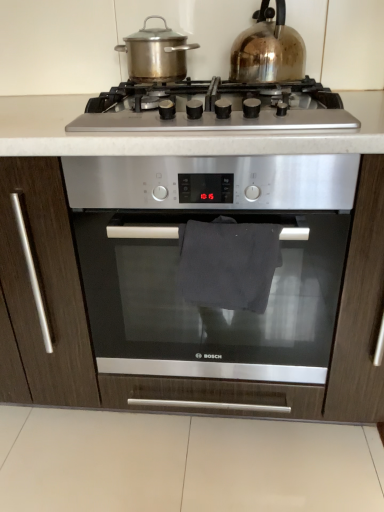
Question: Is dark fabric towel at center directly adjacent to stainless steel pot at upper center, placed as the first kitchen appliance when sorted from left to right?

Choices:
 (A) no
 (B) yes

Answer: (A)

Question: Can stainless steel pot at upper center, which is counted as the second kitchen appliance, starting from the right, be found inside dark fabric towel at center?

Choices:
 (A) yes
 (B) no

Answer: (B)

Question: Considering the relative positions of dark fabric towel at center and stainless steel pot at upper center, which is counted as the second kitchen appliance, starting from the right, in the image provided, is dark fabric towel at center to the left of stainless steel pot at upper center, which is counted as the second kitchen appliance, starting from the right, from the viewer's perspective?

Choices:
 (A) yes
 (B) no

Answer: (B)

Question: Does dark fabric towel at center have a greater width compared to stainless steel pot at upper center, which is counted as the second kitchen appliance, starting from the right?

Choices:
 (A) no
 (B) yes

Answer: (A)

Question: Does dark fabric towel at center lie behind stainless steel pot at upper center, which is counted as the second kitchen appliance, starting from the right?

Choices:
 (A) no
 (B) yes

Answer: (A)

Question: Can you confirm if dark fabric towel at center is smaller than stainless steel pot at upper center, which is counted as the second kitchen appliance, starting from the right?

Choices:
 (A) yes
 (B) no

Answer: (A)

Question: From a real-world perspective, is shiny metallic kettle at upper right, the 2th kitchen appliance when ordered from left to right, physically below stainless steel pot at upper center, which is counted as the second kitchen appliance, starting from the right?

Choices:
 (A) no
 (B) yes

Answer: (A)

Question: Is shiny metallic kettle at upper right, which is counted as the 1th kitchen appliance, starting from the right, thinner than stainless steel pot at upper center, placed as the first kitchen appliance when sorted from left to right?

Choices:
 (A) no
 (B) yes

Answer: (A)

Question: From a real-world perspective, is shiny metallic kettle at upper right, the 2th kitchen appliance when ordered from left to right, on top of stainless steel pot at upper center, which is counted as the second kitchen appliance, starting from the right?

Choices:
 (A) yes
 (B) no

Answer: (A)

Question: Is shiny metallic kettle at upper right, the 2th kitchen appliance when ordered from left to right, at the left side of stainless steel pot at upper center, which is counted as the second kitchen appliance, starting from the right?

Choices:
 (A) yes
 (B) no

Answer: (B)

Question: Can you confirm if shiny metallic kettle at upper right, the 2th kitchen appliance when ordered from left to right, is wider than stainless steel pot at upper center, which is counted as the second kitchen appliance, starting from the right?

Choices:
 (A) yes
 (B) no

Answer: (A)

Question: Is shiny metallic kettle at upper right, which is counted as the 1th kitchen appliance, starting from the right, looking in the opposite direction of stainless steel pot at upper center, which is counted as the second kitchen appliance, starting from the right?

Choices:
 (A) yes
 (B) no

Answer: (B)

Question: Is shiny metallic kettle at upper right, which is counted as the 1th kitchen appliance, starting from the right, in front of satin silver oven at center?

Choices:
 (A) no
 (B) yes

Answer: (A)